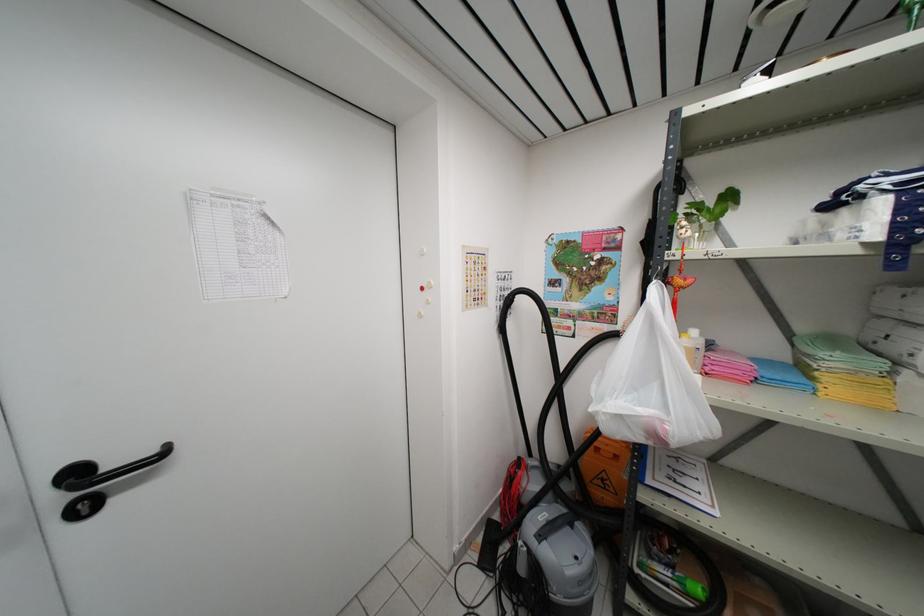
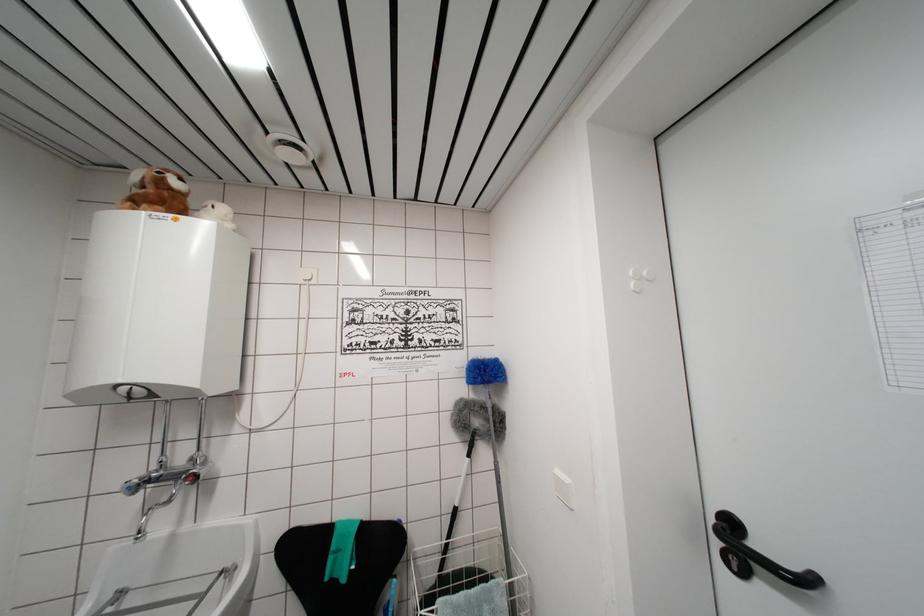
The point at (91, 517) is marked in the first image. Where is the corresponding point in the second image?

(738, 573)